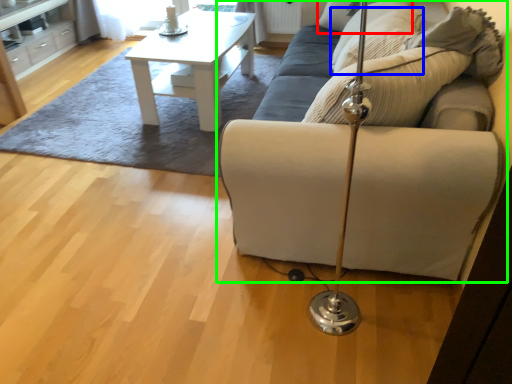
Question: Based on their relative distances, which object is farther from pillow (highlighted by a red box)? Choose from pillow (highlighted by a blue box) and studio couch (highlighted by a green box).

Choices:
 (A) pillow
 (B) studio couch

Answer: (B)